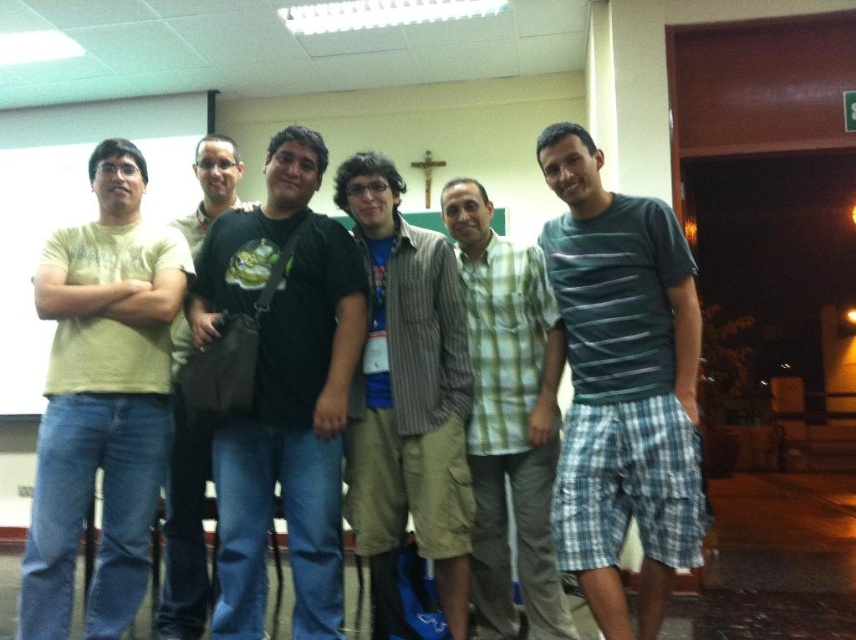
This screenshot has width=856, height=640. What do you see at coordinates (102, 400) in the screenshot?
I see `light yellow t-shirt at left` at bounding box center [102, 400].

The width and height of the screenshot is (856, 640). What are the coordinates of `light yellow t-shirt at left` in the screenshot? It's located at (102, 400).

Who is more distant from viewer, (39, 529) or (177, 529)?

Point (177, 529)

Find the location of a particular element. The width and height of the screenshot is (856, 640). light yellow t-shirt at left is located at coordinates (102, 400).

Is green striped t-shirt at center positioned behind light yellow t-shirt at left?

No, green striped t-shirt at center is closer to the viewer.

Who is lower down, green striped t-shirt at center or light yellow t-shirt at left?

light yellow t-shirt at left

I want to click on green striped t-shirt at center, so click(x=622, y=385).

Which is more to the left, striped cotton shirt at center or green plaid shirt at center?

Positioned to the left is striped cotton shirt at center.

Is striped cotton shirt at center positioned in front of green plaid shirt at center?

That is True.

Identify the location of striped cotton shirt at center. The width and height of the screenshot is (856, 640). (407, 397).

Identify the location of striped cotton shirt at center. The image size is (856, 640). (407, 397).